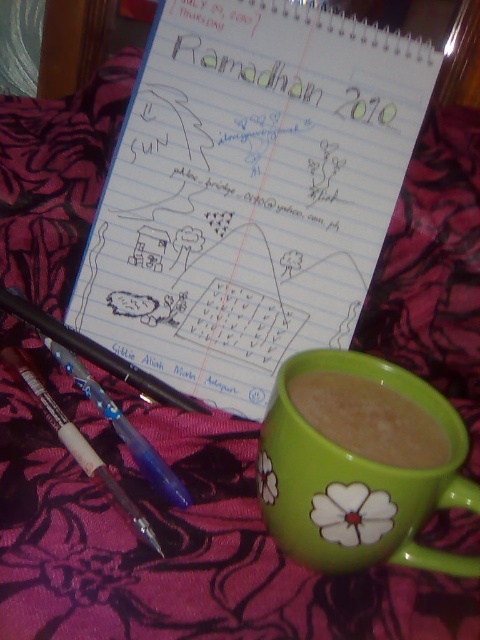
You are organizing a study session and need to place a water bottle on the desk. The desk has a green ceramic mug at center. Where should you place the water bottle to avoid knocking over the mug?

Place the water bottle away from the green ceramic mug at center, which is located at point (356, 480). Position it in an area that is not directly near the mug to prevent accidental spills or knocks.

You are organizing a desk and need to place the green matte mug at lower right and the white plastic pen at lower left. According to the scene, where should you position the green matte mug relative to the white plastic pen?

The green matte mug at lower right should be positioned to the right of the white plastic pen at lower left.

You are organizing a desk and need to place the white lined paper at center and the green ceramic mug at center. According to the image, where should you position them relative to each other?

The white lined paper at center should be placed above the green ceramic mug at center as per the image.